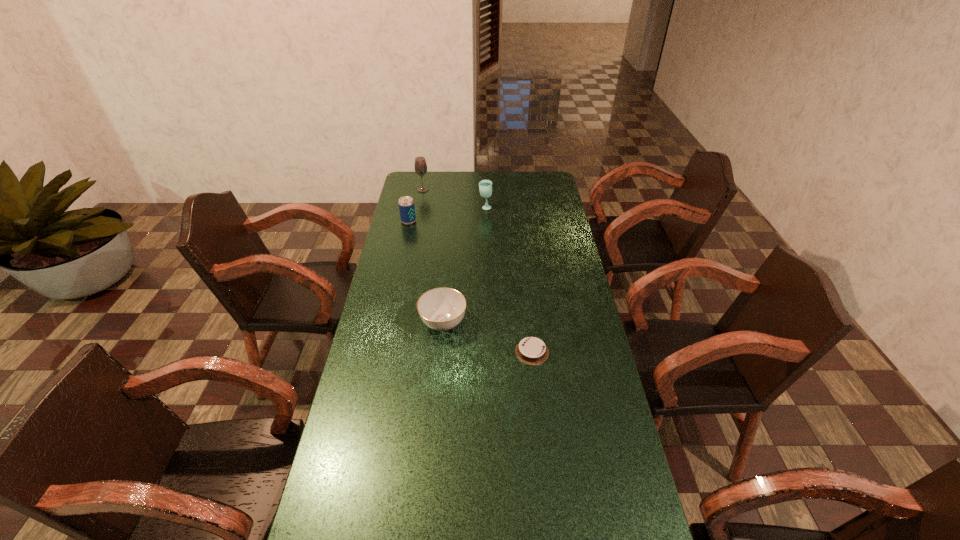
You are a GUI agent. You are given a task and a screenshot of the screen. Output one action in this format:
    pyautogui.click(x=<x>, y=<y>)
    Task: Click on the vacant region located on the front of the fourth nearest object
    
    Given the screenshot: What is the action you would take?
    pyautogui.click(x=486, y=227)

At what (x,y) coordinates should I click in order to perform the action: click on free space located on the front of the third farthest object. Please return your answer as a coordinate pair (x, y). Looking at the image, I should click on (403, 246).

Locate an element on the screen. This screenshot has width=960, height=540. free space located on the right of the chinaware is located at coordinates (575, 323).

The height and width of the screenshot is (540, 960). Identify the location of vacant region located on the back of the shortest object. (523, 271).

Locate an element on the screen. The image size is (960, 540). object at the far edge is located at coordinates (420, 166).

Locate an element on the screen. glass drink container at the left edge is located at coordinates (420, 166).

Identify the location of beer can at the left edge. Image resolution: width=960 pixels, height=540 pixels. (406, 204).

The image size is (960, 540). I want to click on object that is positioned at the far left corner, so click(x=420, y=166).

In the image, there is a desktop. Where is `vacant region at the far edge`? This screenshot has width=960, height=540. vacant region at the far edge is located at coordinates (507, 183).

In the image, there is a desktop. Find the location of `vacant region at the left edge`. vacant region at the left edge is located at coordinates (392, 375).